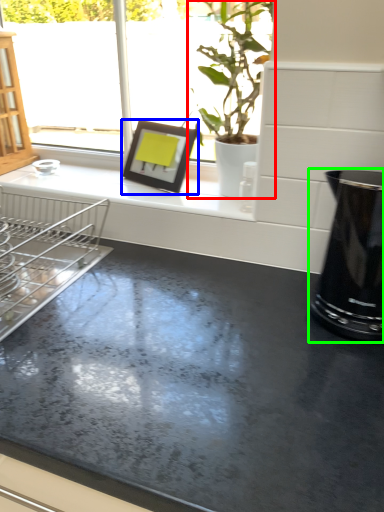
Question: Considering the real-world distances, which object is farthest from houseplant (highlighted by a red box)? picture frame (highlighted by a blue box) or appliance (highlighted by a green box)?

Choices:
 (A) picture frame
 (B) appliance

Answer: (B)